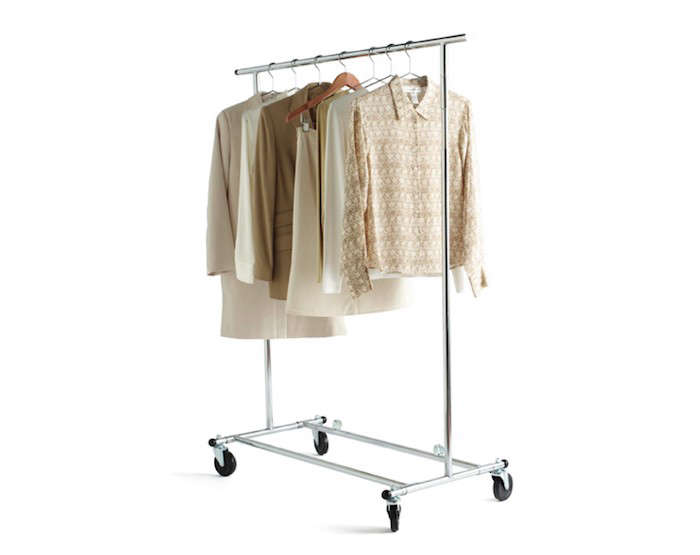
Locate an element on the screen. Image resolution: width=700 pixels, height=555 pixels. metal hanging portions hangers is located at coordinates (406, 48), (386, 48), (368, 51), (337, 57), (315, 58), (292, 63), (270, 67).